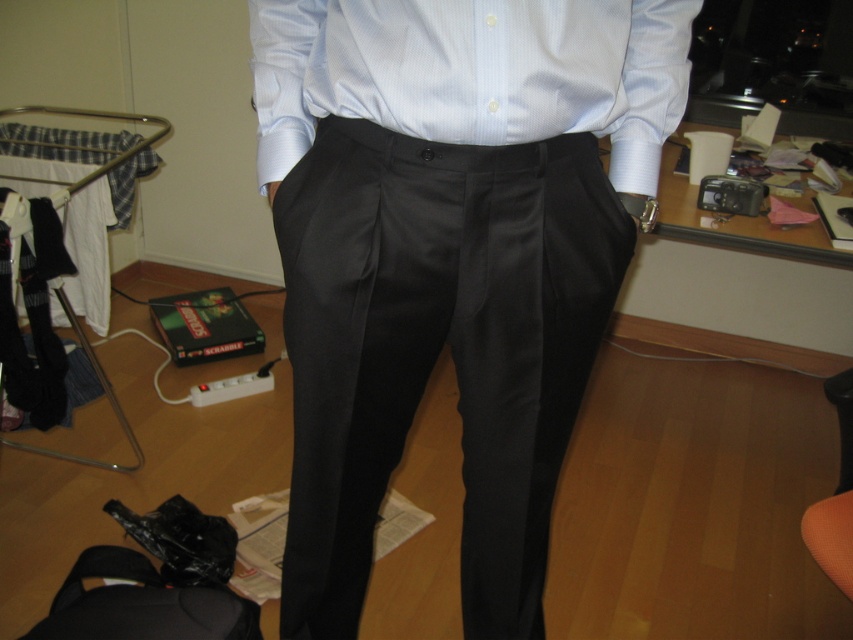
Question: Is satin black trousers at center bigger than satin smooth shirt at center?

Choices:
 (A) no
 (B) yes

Answer: (B)

Question: Which point appears closest to the camera in this image?

Choices:
 (A) (524, 547)
 (B) (291, 76)

Answer: (B)

Question: Is satin black trousers at center to the right of satin smooth shirt at center from the viewer's perspective?

Choices:
 (A) no
 (B) yes

Answer: (A)

Question: Which point is closer to the camera?

Choices:
 (A) satin black trousers at center
 (B) satin smooth shirt at center

Answer: (B)

Question: Does satin black trousers at center come behind satin smooth shirt at center?

Choices:
 (A) no
 (B) yes

Answer: (B)